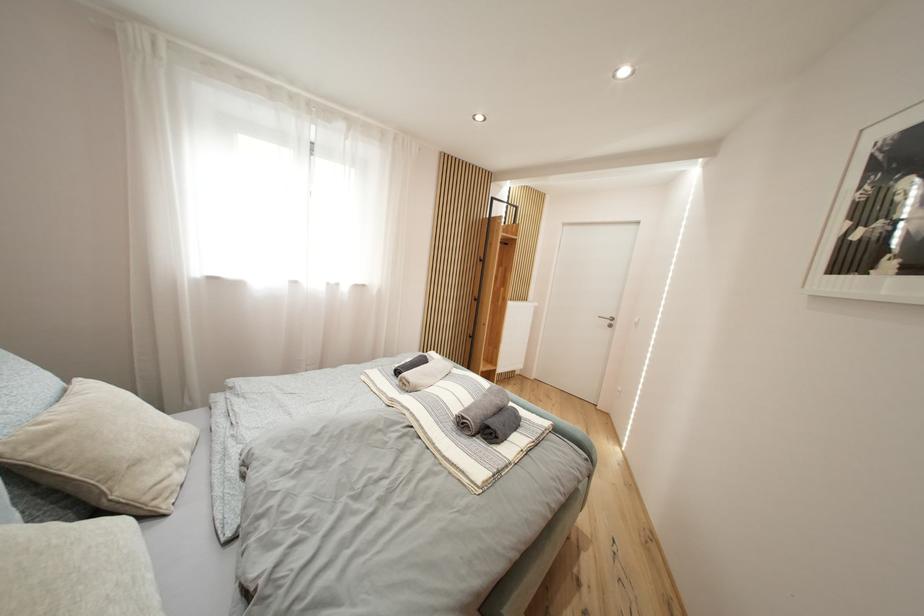
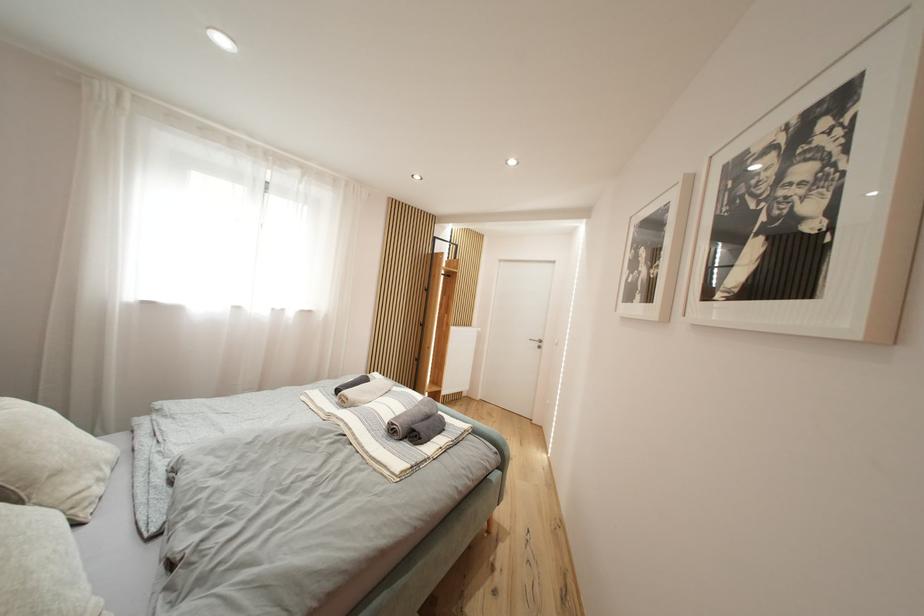
What movement of the cameraman would produce the second image?

The cameraman moved toward right, backward.